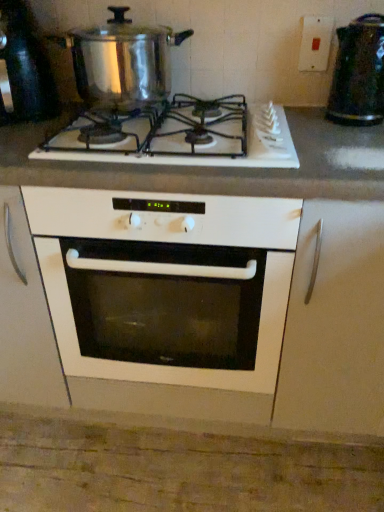
Image resolution: width=384 pixels, height=512 pixels. What are the coordinates of `white glossy gas stove at center` in the screenshot? It's located at (182, 136).

Describe the element at coordinates (182, 136) in the screenshot. I see `white glossy gas stove at center` at that location.

What do you see at coordinates (358, 73) in the screenshot? I see `metallic textured kettle at upper right, the first appliance viewed from the right` at bounding box center [358, 73].

The width and height of the screenshot is (384, 512). What are the coordinates of `white plastic switch at upper right` in the screenshot? It's located at (315, 42).

Considering the points (355, 122) and (156, 49), which point is behind, point (355, 122) or point (156, 49)?

The point (156, 49) is farther.

Is shiny metallic pot at upper left at the back of metallic textured kettle at upper right, acting as the second appliance starting from the left?

No.

Between metallic textured kettle at upper right, the first appliance viewed from the right, and shiny metallic pot at upper left, which one appears on the left side from the viewer's perspective?

Positioned to the left is shiny metallic pot at upper left.

Does shiny metallic pot at upper left have a lesser height compared to white glossy countertop at center?

Correct, shiny metallic pot at upper left is not as tall as white glossy countertop at center.

From the image's perspective, which one is positioned lower, shiny metallic pot at upper left or white glossy countertop at center?

white glossy countertop at center, from the image's perspective.

How much distance is there between shiny metallic pot at upper left and white glossy countertop at center?

shiny metallic pot at upper left is 21.64 inches from white glossy countertop at center.

From a real-world perspective, is shiny metallic pot at upper left physically located above or below white glossy countertop at center?

In terms of real-world spatial position, shiny metallic pot at upper left is above white glossy countertop at center.

Can you confirm if white glossy gas stove at center is bigger than white glossy countertop at center?

No, white glossy gas stove at center is not bigger than white glossy countertop at center.

From a real-world perspective, is white glossy gas stove at center above or below white glossy countertop at center?

From a real-world perspective, white glossy gas stove at center is physically above white glossy countertop at center.

Is white glossy gas stove at center looking in the opposite direction of white glossy countertop at center?

white glossy gas stove at center does not have its back to white glossy countertop at center.

How many degrees apart are the facing directions of white glossy gas stove at center and metallic textured kettle at upper right, acting as the second appliance starting from the left?

0.207 degrees separate the facing orientations of white glossy gas stove at center and metallic textured kettle at upper right, acting as the second appliance starting from the left.

Is white glossy gas stove at center inside the boundaries of metallic textured kettle at upper right, acting as the second appliance starting from the left, or outside?

white glossy gas stove at center is not inside metallic textured kettle at upper right, acting as the second appliance starting from the left, it's outside.

Can you confirm if white glossy gas stove at center is smaller than metallic textured kettle at upper right, the first appliance viewed from the right?

No.

Based on the photo, is metallic textured kettle at upper right, acting as the second appliance starting from the left, at the back of white glossy gas stove at center?

That's not correct — white glossy gas stove at center is not looking away from metallic textured kettle at upper right, acting as the second appliance starting from the left.

From a real-world perspective, which is physically below, metallic textured kettle at upper right, the first appliance viewed from the right, or white glossy countertop at center?

From a 3D spatial view, white glossy countertop at center is below.

Considering the positions of point (372, 77) and point (303, 188), is point (372, 77) closer or farther from the camera than point (303, 188)?

Clearly, point (372, 77) is more distant from the camera than point (303, 188).

Identify the location of appliance on the right of white glossy countertop at center. Image resolution: width=384 pixels, height=512 pixels. (358, 73).

Is white matte cabinet door at right wider than white plastic switch at upper right?

Indeed, white matte cabinet door at right has a greater width compared to white plastic switch at upper right.

Is white matte cabinet door at right turned away from white plastic switch at upper right?

white matte cabinet door at right is not turned away from white plastic switch at upper right.

In the scene shown: Would you consider white matte cabinet door at right to be distant from white plastic switch at upper right?

white matte cabinet door at right is near white plastic switch at upper right, not far away.

Measure the distance from white matte cabinet door at right to white plastic switch at upper right.

white matte cabinet door at right is 30.11 inches from white plastic switch at upper right.

Locate an element on the screen. This screenshot has height=512, width=384. appliance on the left of the white matte cabinet door at right is located at coordinates (23, 69).

In terms of size, does white matte cabinet door at right appear bigger or smaller than shiny metallic pot at upper left, positioned as the 1th appliance in left-to-right order?

white matte cabinet door at right is bigger than shiny metallic pot at upper left, positioned as the 1th appliance in left-to-right order.

From the image's perspective, is white matte cabinet door at right located above or below shiny metallic pot at upper left, positioned as the 1th appliance in left-to-right order?

white matte cabinet door at right is situated lower than shiny metallic pot at upper left, positioned as the 1th appliance in left-to-right order, in the image.

Which is more to the right, white matte cabinet door at right or shiny metallic pot at upper left, positioned as the 1th appliance in left-to-right order?

white matte cabinet door at right is more to the right.

Identify the location of appliance below the shiny metallic pot at upper left (from the image's perspective). (358, 73).

The width and height of the screenshot is (384, 512). Find the location of `kitchen appliance that is on the left side of white glossy countertop at center`. kitchen appliance that is on the left side of white glossy countertop at center is located at coordinates (121, 61).

Based on their spatial positions, is metallic textured kettle at upper right, acting as the second appliance starting from the left, or white plastic switch at upper right further from white matte cabinet door at right?

The object further to white matte cabinet door at right is white plastic switch at upper right.

When comparing their distances from white matte cabinet door at right, does shiny metallic pot at upper left or white glossy gas stove at center seem closer?

white glossy gas stove at center is positioned closer to the anchor white matte cabinet door at right.

Considering their positions, is white plastic switch at upper right positioned further to white matte cabinet door at right than shiny metallic pot at upper left, positioned as the 1th appliance in left-to-right order?

Among the two, shiny metallic pot at upper left, positioned as the 1th appliance in left-to-right order, is located further to white matte cabinet door at right.

Based on their spatial positions, is white glossy gas stove at center or shiny metallic pot at upper left further from white glossy countertop at center?

shiny metallic pot at upper left lies further to white glossy countertop at center than the other object.

Estimate the real-world distances between objects in this image. Which object is closer to metallic textured kettle at upper right, acting as the second appliance starting from the left, white glossy gas stove at center or white plastic switch at upper right?

Among the two, white plastic switch at upper right is located nearer to metallic textured kettle at upper right, acting as the second appliance starting from the left.

Based on their spatial positions, is metallic textured kettle at upper right, acting as the second appliance starting from the left, or white glossy countertop at center further from white matte cabinet door at right?

metallic textured kettle at upper right, acting as the second appliance starting from the left, is positioned further to the anchor white matte cabinet door at right.

From the image, which object appears to be nearer to shiny metallic pot at upper left, white matte cabinet door at right or metallic textured kettle at upper right, acting as the second appliance starting from the left?

metallic textured kettle at upper right, acting as the second appliance starting from the left.

Which object lies nearer to the anchor point shiny metallic pot at upper left, which is counted as the 2th appliance, starting from the right, white glossy gas stove at center or white glossy countertop at center?

white glossy gas stove at center lies closer to shiny metallic pot at upper left, which is counted as the 2th appliance, starting from the right, than the other object.

Find the location of a particular element. The width and height of the screenshot is (384, 512). electric outlet between shiny metallic pot at upper left, which is counted as the 2th appliance, starting from the right, and metallic textured kettle at upper right, the first appliance viewed from the right is located at coordinates (315, 42).

This screenshot has width=384, height=512. I want to click on gas stove between shiny metallic pot at upper left, positioned as the 1th appliance in left-to-right order, and white matte cabinet door at right, so click(182, 136).

Locate an element on the screen. appliance between shiny metallic pot at upper left and white glossy countertop at center vertically is located at coordinates (358, 73).

You are a GUI agent. You are given a task and a screenshot of the screen. Output one action in this format:
    pyautogui.click(x=<x>, y=<y>)
    Task: Click on the kitchen appliance between shiny metallic pot at upper left, which is counted as the 2th appliance, starting from the right, and white plastic switch at upper right
    
    Given the screenshot: What is the action you would take?
    pyautogui.click(x=121, y=61)